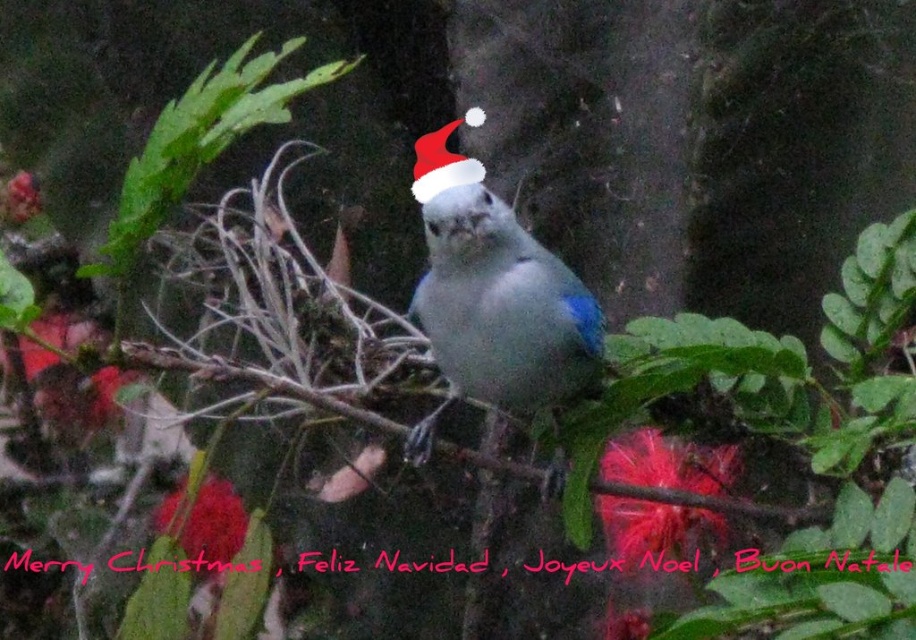
Question: Which object appears closest to the camera in this image?

Choices:
 (A) white fabric santa hat at center
 (B) matte white bird at center

Answer: (B)

Question: Can you confirm if matte white bird at center is bigger than white fabric santa hat at center?

Choices:
 (A) yes
 (B) no

Answer: (A)

Question: Is matte white bird at center positioned in front of white fabric santa hat at center?

Choices:
 (A) no
 (B) yes

Answer: (B)

Question: Which point is closer to the camera?

Choices:
 (A) (489, 202)
 (B) (427, 196)

Answer: (B)

Question: Does matte white bird at center have a smaller size compared to white fabric santa hat at center?

Choices:
 (A) no
 (B) yes

Answer: (A)